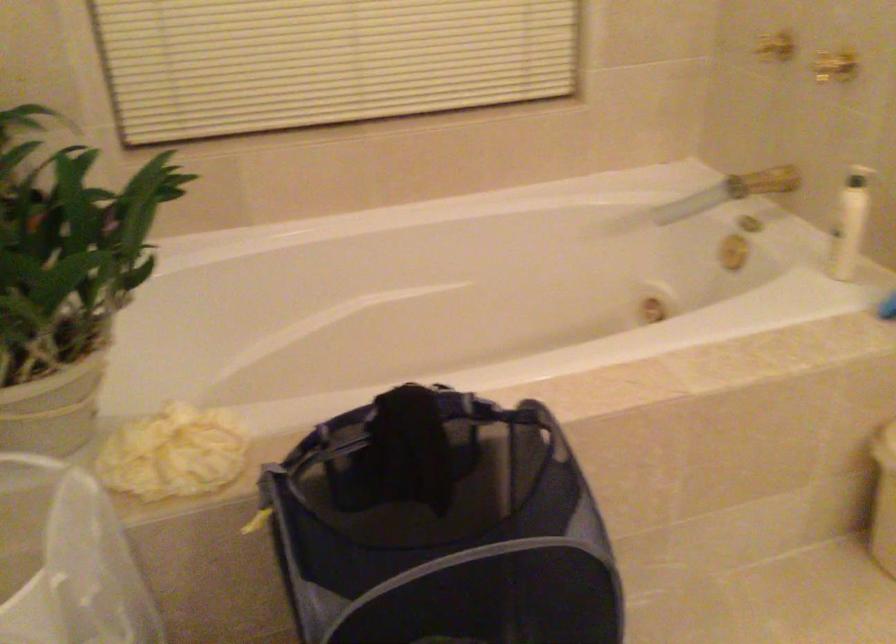
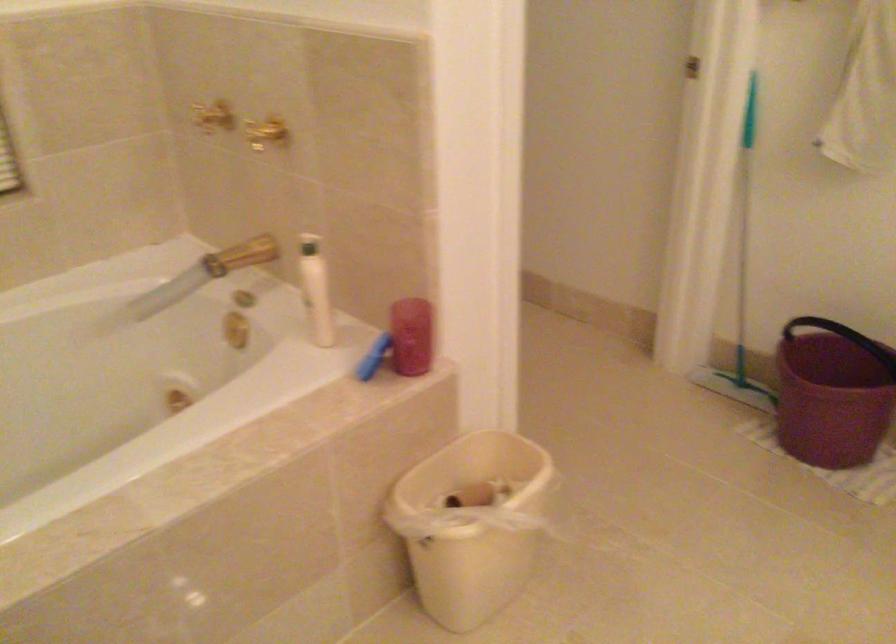
Question: What movement of the cameraman would produce the second image?

Choices:
 (A) Left
 (B) Right
 (C) Forward
 (D) Backward

Answer: (B)